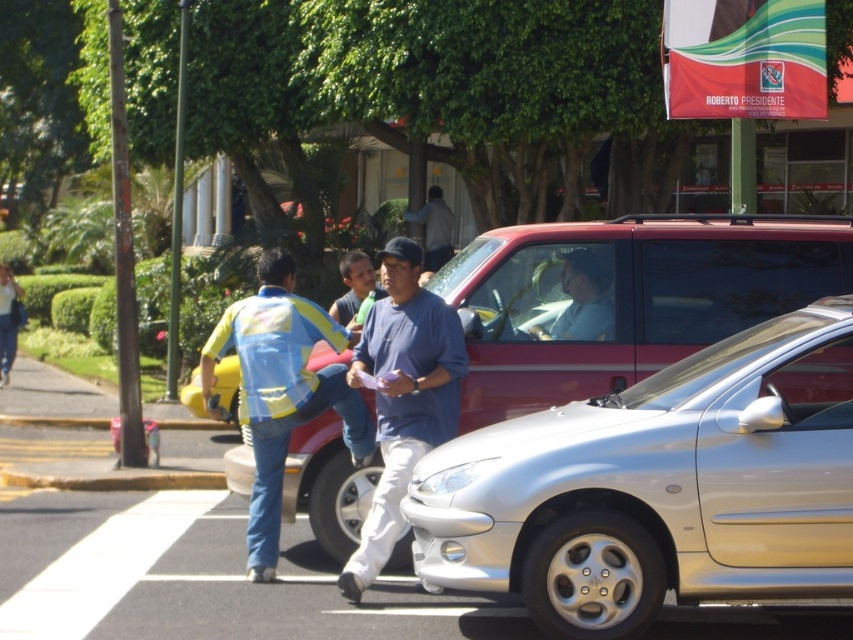
You are a pedestrian standing on the sidewalk and see the yellow reflective safety vest at center and the denim jacket at left in the scene. Which clothing item is closer to your eye level?

The denim jacket at left is taller than the yellow reflective safety vest at center, so the denim jacket at left is closer to your eye level.

You are a pedestrian standing in the street scene. You notice the yellow reflective vest at center and the denim jacket at left. Which object is wider from your perspective?

The yellow reflective vest at center is wider than the denim jacket at left.

You are a delivery person who needs to park your motorcycle between the silver metallic car at center and the blue cotton shirt at center. Can your motorcycle, which is 1.5 meters wide, fit in the space between them?

The silver metallic car at center is bigger than blue cotton shirt at center, but the exact distance between them isn